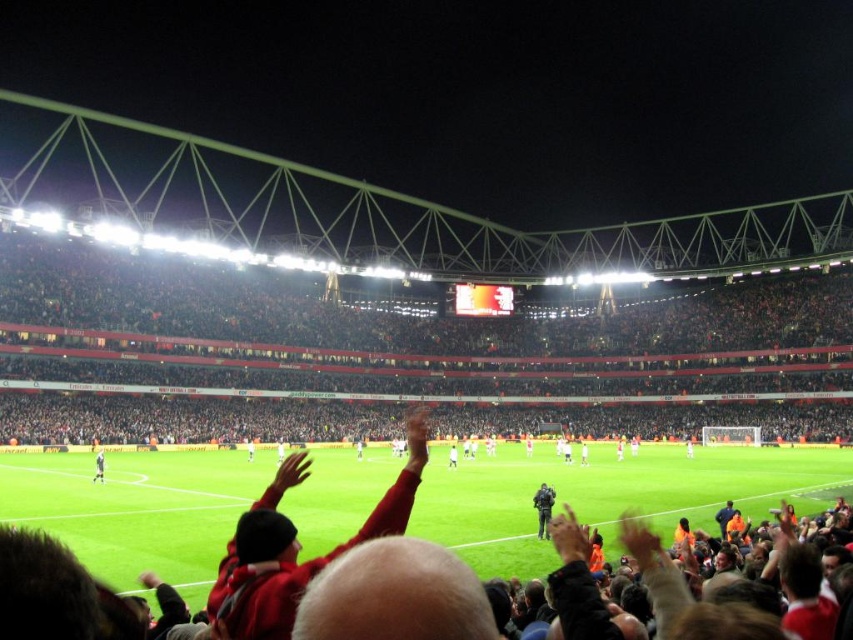
Question: Which of the following is the farthest from the observer?

Choices:
 (A) (677, 481)
 (B) (534, 500)
 (C) (103, 467)

Answer: (A)

Question: Which object is positioned closest to the dark gray uniform at center?

Choices:
 (A) green grass football field at center
 (B) white jersey at center

Answer: (A)

Question: Can you confirm if dark red fabric crowd at center is positioned to the left of green grass football field at center?

Choices:
 (A) no
 (B) yes

Answer: (B)

Question: Which object is positioned closest to the dark gray uniform at center?

Choices:
 (A) dark red fabric crowd at center
 (B) green grass football field at center

Answer: (B)

Question: Is dark gray uniform at center bigger than white jersey at center?

Choices:
 (A) no
 (B) yes

Answer: (A)

Question: Is dark red fabric crowd at center in front of green grass football field at center?

Choices:
 (A) yes
 (B) no

Answer: (B)